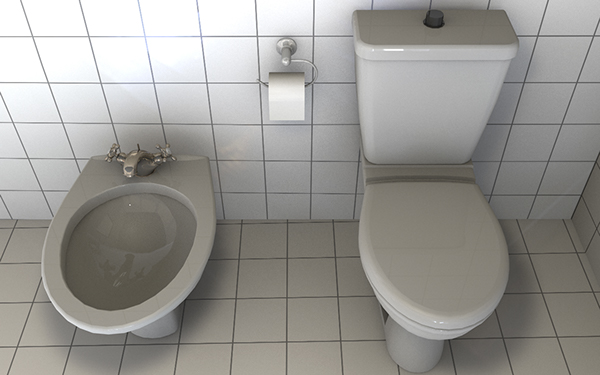
The height and width of the screenshot is (375, 600). I want to click on sink, so click(x=117, y=262).